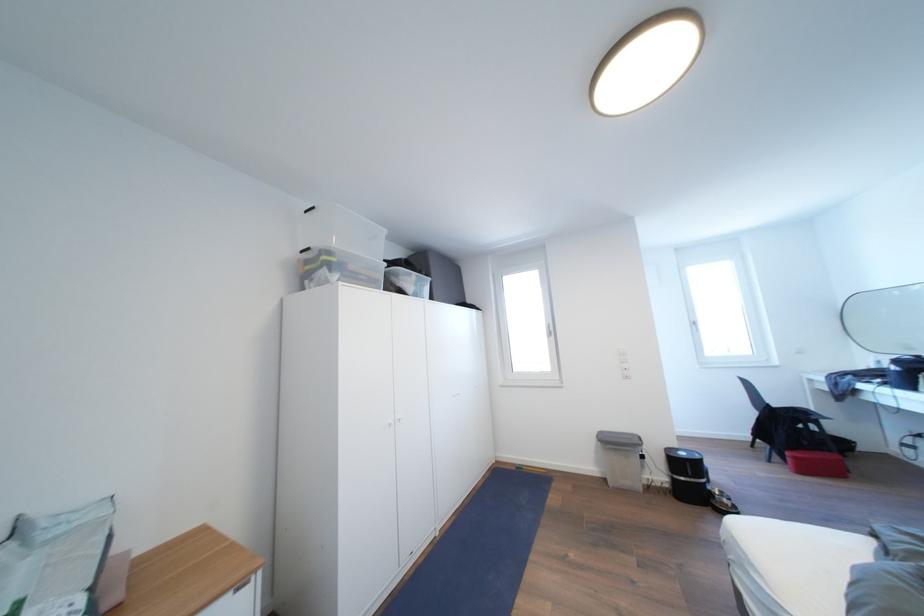
Describe the element at coordinates (549, 329) in the screenshot. I see `the white window handle` at that location.